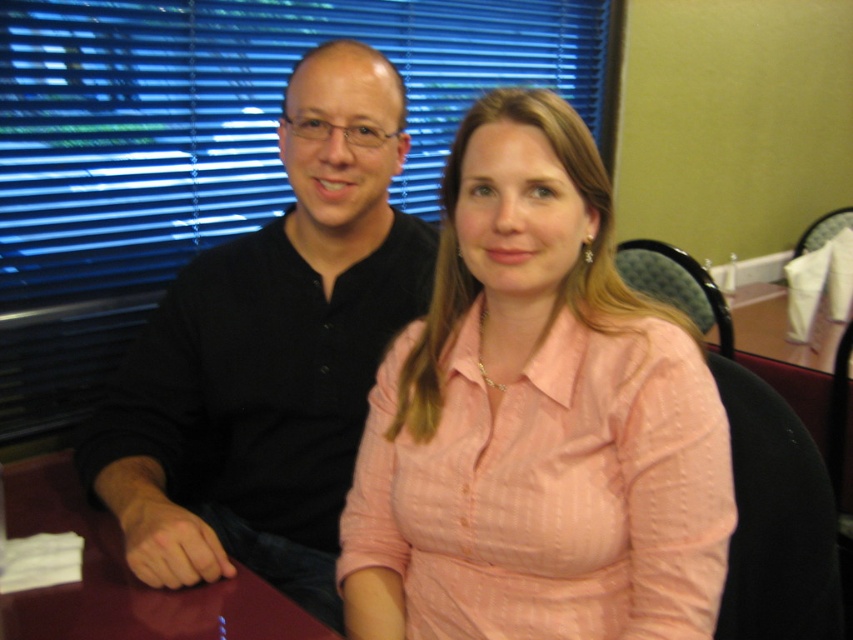
You are a photographer trying to position a spotlight exactly at the center of the image. The pink textured shirt at center is located at coordinates point 0.658, 0.630. Is the shirt positioned to the left or right of the image center?

The pink textured shirt at center is located at coordinates point (537, 420). Since the x coordinate 0.658 is greater than 0.5, the shirt is positioned to the right of the image center.

You are a photographer adjusting your camera settings to focus on the pink textured shirt at center and the blue matte blinds at upper center. Which object should you focus on first to ensure both are in sharp focus?

The pink textured shirt at center is closer to the viewer than the blue matte blinds at upper center, so you should focus on the pink textured shirt at center first to ensure both are in sharp focus.

You are a fashion designer observing two shirts in a photo. You need to determine which one is smaller. The shirts are the pink textured shirt at center and the black matte shirt at left. Based on the image, which shirt has a smaller size?

The pink textured shirt at center has a smaller size compared to the black matte shirt at left.